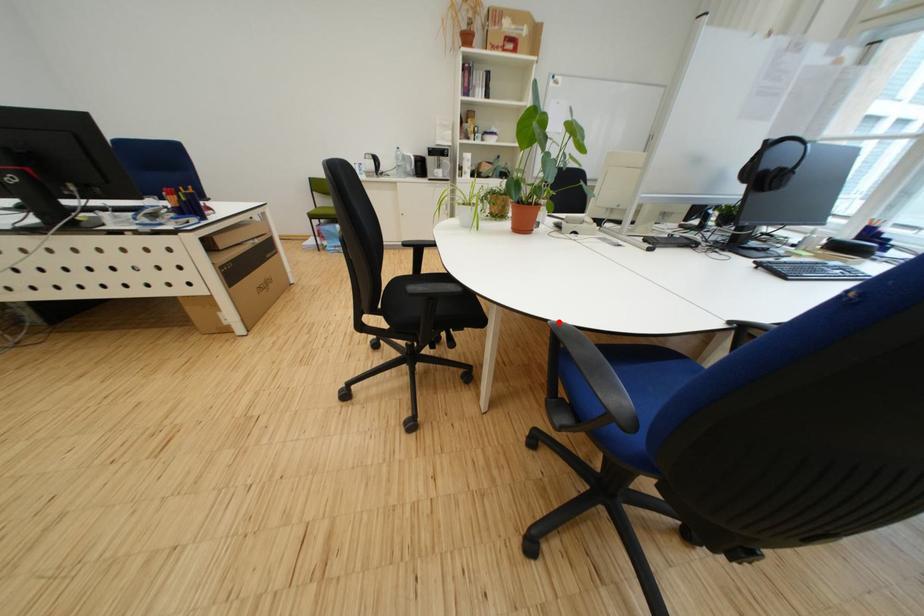
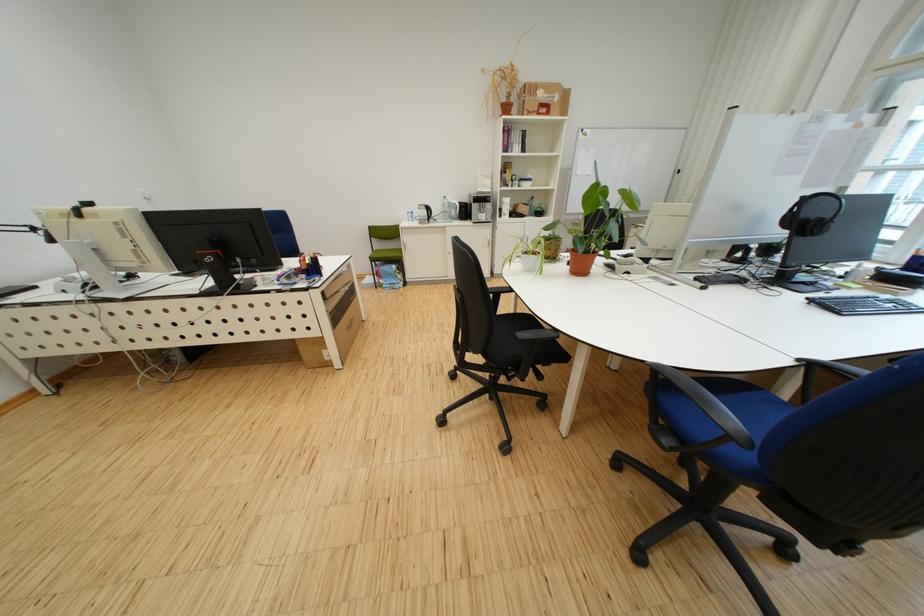
Question: I am providing you with two images of the same scene from different viewpoints. Image1 has a red point marked. In image2, the corresponding 3D location appears at what relative position? Reply with the corresponding letter.

Choices:
 (A) Closer
 (B) Farther

Answer: (A)